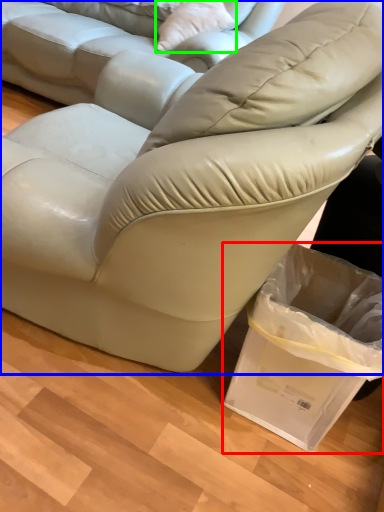
Question: Estimate the real-world distances between objects in this image. Which object is farther from shopping bag (highlighted by a red box), studio couch (highlighted by a blue box) or throw pillow (highlighted by a green box)?

Choices:
 (A) studio couch
 (B) throw pillow

Answer: (B)